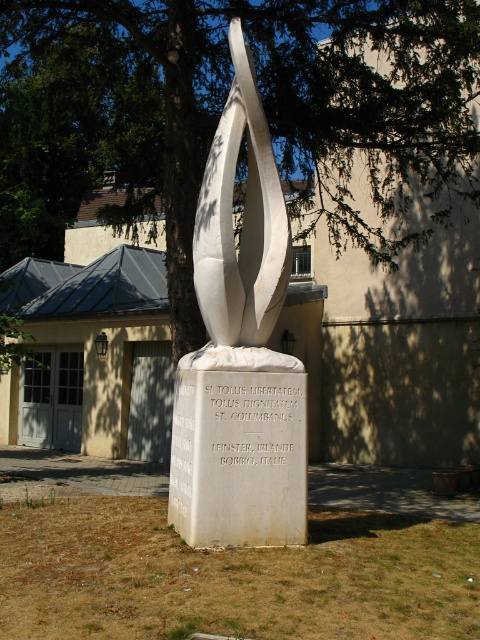
Question: Which point is farther to the camera?

Choices:
 (A) (436, 120)
 (B) (272, 173)

Answer: (A)

Question: Among these objects, which one is nearest to the camera?

Choices:
 (A) white polished stone sculpture at center
 (B) green leafy tree at center

Answer: (A)

Question: Does green leafy tree at center appear on the right side of white polished stone sculpture at center?

Choices:
 (A) no
 (B) yes

Answer: (A)

Question: Is green leafy tree at center thinner than white polished stone sculpture at center?

Choices:
 (A) yes
 (B) no

Answer: (B)

Question: Is green leafy tree at center below white polished stone sculpture at center?

Choices:
 (A) no
 (B) yes

Answer: (A)